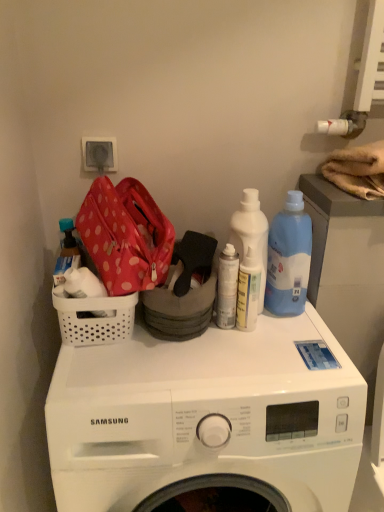
Identify the location of free spot in front of blue plastic bottle at upper right, which appears as the 3th cleaning product when viewed from the left. This screenshot has height=512, width=384. (286, 344).